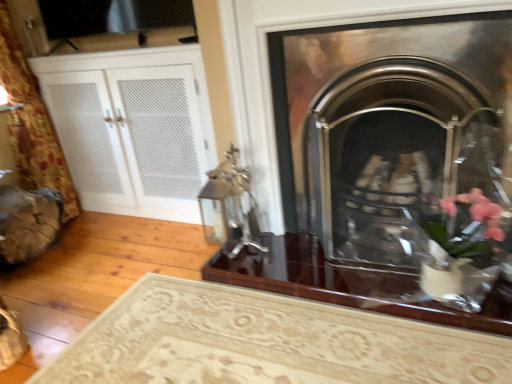
Question: Which is correct: polished metal fireplace at center, arranged as the 1th fireplace when ordered from the bottom, is inside wooden log at lower left, or outside of it?

Choices:
 (A) inside
 (B) outside

Answer: (B)

Question: From their relative heights in the image, would you say polished metal fireplace at center, arranged as the 1th fireplace when ordered from the bottom, is taller or shorter than wooden log at lower left?

Choices:
 (A) tall
 (B) short

Answer: (A)

Question: Which object is the farthest from the polished chrome fireplace at center, arranged as the 1th fireplace when viewed from the top?

Choices:
 (A) white mesh cabinet at left
 (B) glossy dark wood table at center
 (C) black mesh screen at upper left
 (D) polished metal fireplace at center, arranged as the 1th fireplace when ordered from the bottom
 (E) wooden log at lower left

Answer: (E)

Question: Which is farther from the polished chrome fireplace at center, arranged as the 1th fireplace when viewed from the top?

Choices:
 (A) glossy dark wood table at center
 (B) black mesh screen at upper left
 (C) wooden log at lower left
 (D) white mesh cabinet at left
 (E) polished metal fireplace at center, arranged as the 1th fireplace when ordered from the bottom

Answer: (C)